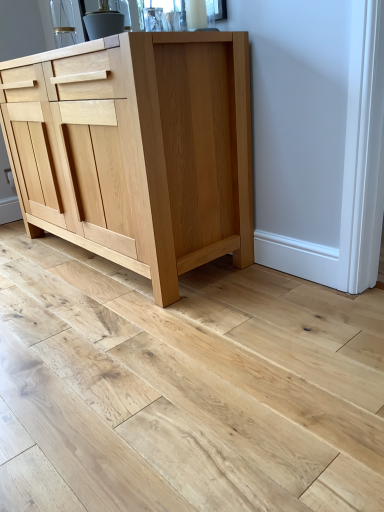
I want to click on vacant region in front of natural wood cabinet at center, so click(x=143, y=348).